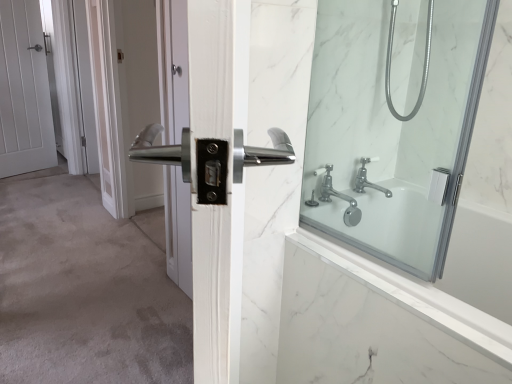
Question: In terms of width, does white matte door at left look wider or thinner when compared to polished silver handle at center, arranged as the 1th screen door when viewed from the front?

Choices:
 (A) thin
 (B) wide

Answer: (A)

Question: Is white matte door at left in front of or behind polished silver handle at center, marked as the 2th screen door in a left-to-right arrangement, in the image?

Choices:
 (A) behind
 (B) front

Answer: (A)

Question: Which object is positioned closest to the clear glass shower door at right?

Choices:
 (A) white matte door at left
 (B) chrome metallic faucet at upper right
 (C) white glossy door at upper left, the second screen door when ordered from right to left
 (D) polished silver handle at center, the second screen door in the back-to-front sequence
 (E) silver metallic hose at upper right

Answer: (E)

Question: Based on their relative distances, which object is farther from the white matte door at left?

Choices:
 (A) polished silver handle at center, marked as the 2th screen door in a left-to-right arrangement
 (B) white marble bath at right
 (C) clear glass shower door at right
 (D) white glossy door at upper left, arranged as the 2th screen door when viewed from the front
 (E) chrome metallic faucet at upper right

Answer: (B)